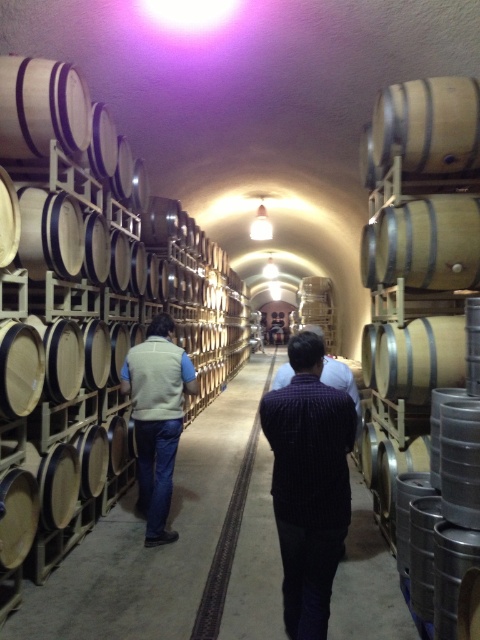
Between dark striped shirt at center and light beige vest at center, which one is positioned lower?

light beige vest at center is below.

You are a GUI agent. You are given a task and a screenshot of the screen. Output one action in this format:
    pyautogui.click(x=<x>, y=<y>)
    Task: Click on the dark striped shirt at center
    The image size is (480, 640).
    Given the screenshot: What is the action you would take?
    pyautogui.click(x=309, y=483)

Who is more distant from viewer, (277, 490) or (170, 321)?

The point (170, 321) is more distant.

Identify the location of dark striped shirt at center. (309, 483).

Can you confirm if dark striped shirt at center is thinner than wooden barrel at center?

Yes.

Is point (288, 570) in front of point (467, 150)?

Yes, it is.

Where is `dark striped shirt at center`? Image resolution: width=480 pixels, height=640 pixels. dark striped shirt at center is located at coordinates (309, 483).

Describe the element at coordinates (422, 129) in the screenshot. I see `wooden barrel at center` at that location.

Who is shorter, wooden barrel at center or light beige vest at center?

wooden barrel at center

Between point (471, 147) and point (151, 458), which one is positioned in front?

Positioned in front is point (471, 147).

The height and width of the screenshot is (640, 480). I want to click on wooden barrel at center, so [422, 129].